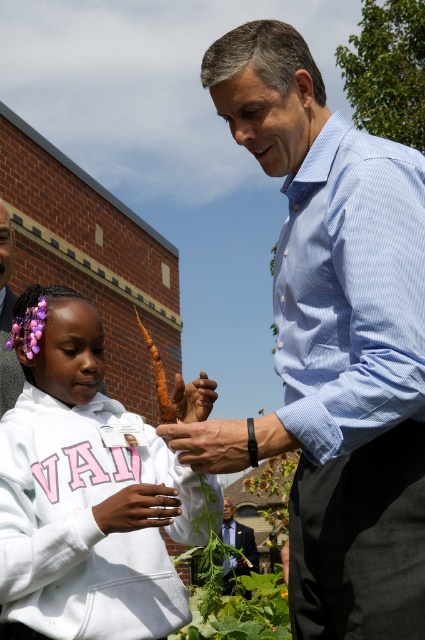
Question: Estimate the real-world distances between objects in this image. Which object is farther from the dark blue shirt at center?

Choices:
 (A) light blue striped shirt at center
 (B) white matte hoodie at center

Answer: (A)

Question: Among these points, which one is farthest from the camera?

Choices:
 (A) (124, 490)
 (B) (240, 531)

Answer: (B)

Question: Can you confirm if white matte hoodie at center is smaller than dark blue shirt at center?

Choices:
 (A) no
 (B) yes

Answer: (B)

Question: Among these objects, which one is nearest to the camera?

Choices:
 (A) dark skin hand at lower left
 (B) dark blue shirt at center

Answer: (A)

Question: Is brown leather hand at center above orange rough carrot at center?

Choices:
 (A) no
 (B) yes

Answer: (A)

Question: Is dark blue shirt at center to the right of brown leather hand at center from the viewer's perspective?

Choices:
 (A) no
 (B) yes

Answer: (B)